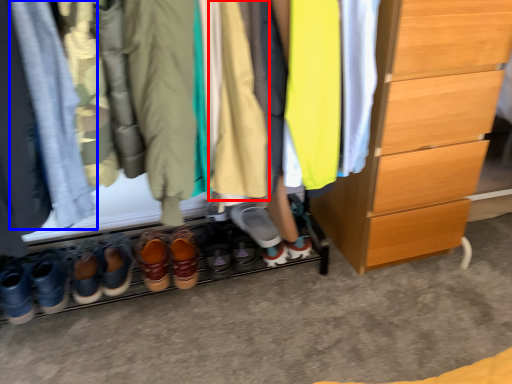
Question: Which object is further to the camera taking this photo, clothing (highlighted by a red box) or clothing (highlighted by a blue box)?

Choices:
 (A) clothing
 (B) clothing

Answer: (A)